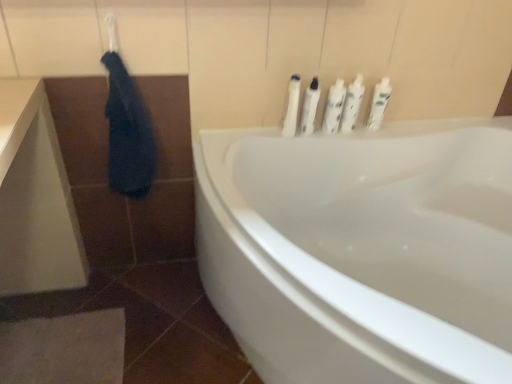
Identify the location of vacant space to the right of white glossy bottles at upper right, the first toiletry viewed from the right. (406, 127).